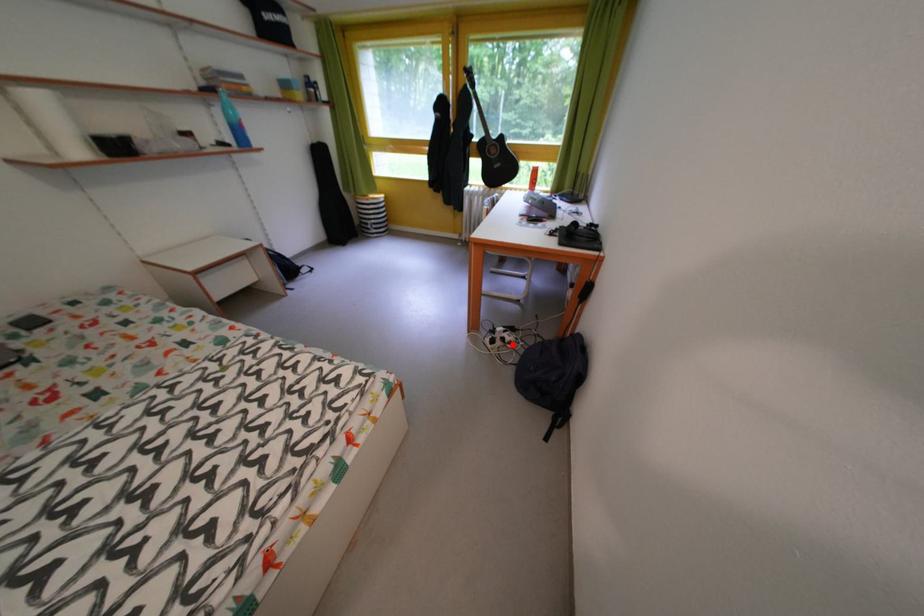
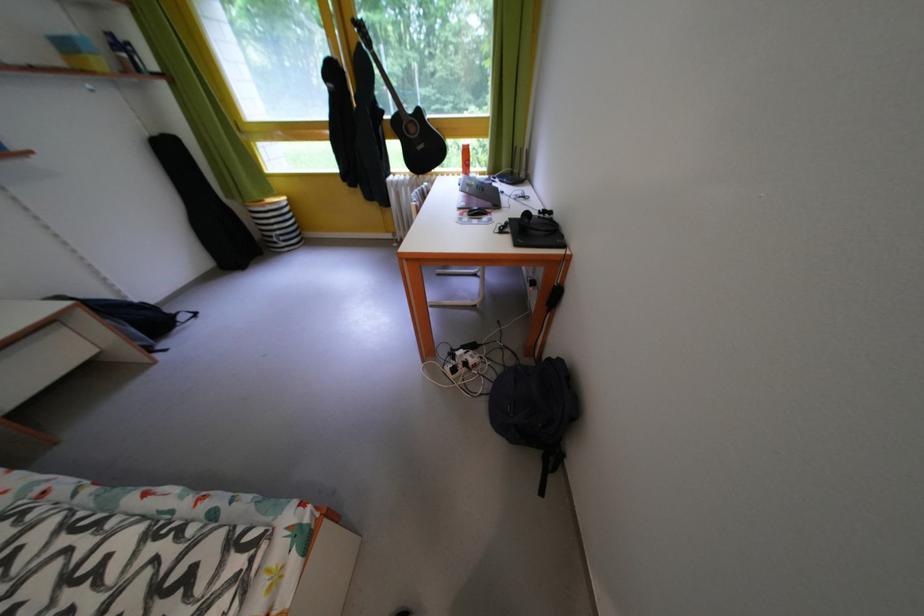
The point at the highlighted location is marked in the first image. Where is the corresponding point in the second image?

(476, 370)